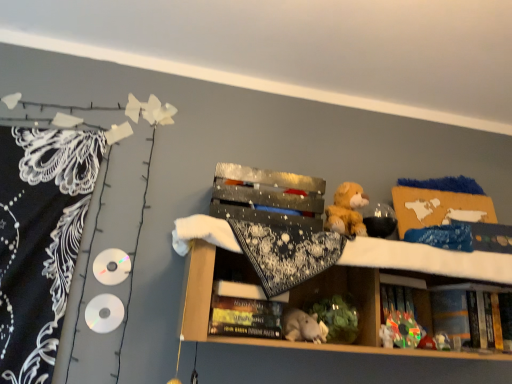
Image resolution: width=512 pixels, height=384 pixels. Describe the element at coordinates (40, 240) in the screenshot. I see `black lace blanket at left` at that location.

The image size is (512, 384). Find the location of `plush toy at center, which is the 2th toy from top to bottom`. plush toy at center, which is the 2th toy from top to bottom is located at coordinates (404, 329).

Describe the element at coordinates (404, 329) in the screenshot. This screenshot has width=512, height=384. I see `plush toy at center, acting as the 2th toy starting from the bottom` at that location.

You are a GUI agent. You are given a task and a screenshot of the screen. Output one action in this format:
    pyautogui.click(x=<x>, y=<y>)
    Task: Click on the black lace blanket at left
    
    Given the screenshot: What is the action you would take?
    pyautogui.click(x=40, y=240)

Between hardcover book at center, the 2th book viewed from the back, and black lace blanket at left, which one has smaller size?

hardcover book at center, the 2th book viewed from the back.

How distant is hardcover book at center, the 2th book viewed from the back, from black lace blanket at left?

hardcover book at center, the 2th book viewed from the back, is 64.89 centimeters from black lace blanket at left.

Considering the relative positions of hardcover book at center, the 2th book from the right, and black lace blanket at left in the image provided, is hardcover book at center, the 2th book from the right, to the right of black lace blanket at left from the viewer's perspective?

Yes, hardcover book at center, the 2th book from the right, is to the right of black lace blanket at left.

From a real-world perspective, between hardcover book at center, the first book from the left, and black lace blanket at left, who is vertically higher?

black lace blanket at left.

Where is `book above the plush toy at center, which is the 2th toy from top to bottom (from the image's perspective)`? This screenshot has width=512, height=384. book above the plush toy at center, which is the 2th toy from top to bottom (from the image's perspective) is located at coordinates pos(245,317).

Is plush toy at center, acting as the 2th toy starting from the bottom, not inside hardcover book at center, the 2th book from the right?

Yes, plush toy at center, acting as the 2th toy starting from the bottom, is not within hardcover book at center, the 2th book from the right.

Could you tell me if plush toy at center, which is the first toy from right to left, is facing hardcover book at center, the 2th book viewed from the back?

No.

Considering the sizes of objects plush toy at center, acting as the 2th toy starting from the bottom, and hardcover book at center, acting as the first book starting from the front, in the image provided, who is smaller, plush toy at center, acting as the 2th toy starting from the bottom, or hardcover book at center, acting as the first book starting from the front,?

plush toy at center, acting as the 2th toy starting from the bottom, is smaller.

Can you tell me how much shiny metallic box at center and fuzzy yellow teddy bear at upper right, which ranks as the first toy in left-to-right order, differ in facing direction?

The facing directions of shiny metallic box at center and fuzzy yellow teddy bear at upper right, which ranks as the first toy in left-to-right order, are 1.12 degrees apart.

Is shiny metallic box at center completely or partially outside of fuzzy yellow teddy bear at upper right, acting as the third toy starting from the bottom?

Yes, shiny metallic box at center is located beyond the bounds of fuzzy yellow teddy bear at upper right, acting as the third toy starting from the bottom.

Is point (202, 255) positioned in front of point (339, 216)?

Yes.

Is shiny metallic box at center behind fuzzy yellow teddy bear at upper right, acting as the third toy starting from the bottom?

That is False.

How distant is fuzzy yellow teddy bear at upper right, the first toy viewed from the top, from shiny metallic box at center?

fuzzy yellow teddy bear at upper right, the first toy viewed from the top, and shiny metallic box at center are 12.62 inches apart.

Considering the sizes of objects fuzzy yellow teddy bear at upper right, the first toy viewed from the top, and shiny metallic box at center in the image provided, who is shorter, fuzzy yellow teddy bear at upper right, the first toy viewed from the top, or shiny metallic box at center?

With less height is fuzzy yellow teddy bear at upper right, the first toy viewed from the top.

Can you confirm if fuzzy yellow teddy bear at upper right, acting as the third toy starting from the bottom, is positioned to the right of shiny metallic box at center?

Incorrect, fuzzy yellow teddy bear at upper right, acting as the third toy starting from the bottom, is not on the right side of shiny metallic box at center.

Consider the image. Is gray plush toy at center thinner than hardcover book at lower right, which ranks as the 1th book in right-to-left order?

Incorrect, the width of gray plush toy at center is not less than that of hardcover book at lower right, which ranks as the 1th book in right-to-left order.

Is point (289, 328) closer to viewer compared to point (478, 292)?

Yes, point (289, 328) is in front of point (478, 292).

Considering the relative positions of black lace blanket at left and hardcover book at lower right, which is the first book in back-to-front order, in the image provided, is black lace blanket at left to the left of hardcover book at lower right, which is the first book in back-to-front order, from the viewer's perspective?

Yes.

Based on the photo, which of these two, black lace blanket at left or hardcover book at lower right, which is the first book in back-to-front order, is thinner?

Thinner between the two is black lace blanket at left.

Is black lace blanket at left shorter than hardcover book at lower right, which ranks as the 1th book in right-to-left order?

Incorrect, the height of black lace blanket at left does not fall short of that of hardcover book at lower right, which ranks as the 1th book in right-to-left order.

From a real-world perspective, is black lace blanket at left below hardcover book at lower right, acting as the 2th book starting from the left?

Incorrect, from a real-world perspective, black lace blanket at left is higher than hardcover book at lower right, acting as the 2th book starting from the left.

Considering the relative positions of hardcover book at center, the 2th book viewed from the back, and fuzzy yellow teddy bear at upper right, the first toy viewed from the top, in the image provided, is hardcover book at center, the 2th book viewed from the back, behind fuzzy yellow teddy bear at upper right, the first toy viewed from the top,?

No, the depth of hardcover book at center, the 2th book viewed from the back, is less than that of fuzzy yellow teddy bear at upper right, the first toy viewed from the top.

At what (x,y) coordinates should I click in order to perform the action: click on toy above the hardcover book at center, the 2th book from the right (from the image's perspective). Please return your answer as a coordinate pair (x, y). This screenshot has height=384, width=512. Looking at the image, I should click on 347,210.

Is hardcover book at center, the first book from the left, facing away from fuzzy yellow teddy bear at upper right, acting as the 3th toy starting from the right?

No, hardcover book at center, the first book from the left,'s orientation is not away from fuzzy yellow teddy bear at upper right, acting as the 3th toy starting from the right.

At what (x,y) coordinates should I click in order to perform the action: click on book that is the 2nd object directly below the black lace blanket at left (from a real-world perspective). Please return your answer as a coordinate pair (x, y). Image resolution: width=512 pixels, height=384 pixels. Looking at the image, I should click on (245, 317).

The width and height of the screenshot is (512, 384). I want to click on the 1st book positioned above the plush toy at center, acting as the 2th toy starting from the bottom (from a real-world perspective), so click(245, 317).

When comparing their distances from plush toy at center, which is the 2th toy from top to bottom, does gray plush toy at center or black lace blanket at left seem closer?

The object closer to plush toy at center, which is the 2th toy from top to bottom, is gray plush toy at center.

Based on their spatial positions, is shiny metallic box at center or gray plush toy at center further from hardcover book at center, the first book from the left?

The object further to hardcover book at center, the first book from the left, is shiny metallic box at center.

Based on their spatial positions, is shiny metallic box at center or plush toy at center, which is the 2th toy from top to bottom, closer to gray plush toy at center?

The object closer to gray plush toy at center is shiny metallic box at center.

Considering their positions, is hardcover book at lower right, acting as the second book starting from the front, positioned closer to plush toy at center, which is counted as the 3th toy, starting from the left, than gray plush toy at center?

Among the two, hardcover book at lower right, acting as the second book starting from the front, is located nearer to plush toy at center, which is counted as the 3th toy, starting from the left.

Looking at the image, which one is located further to plush toy at center, acting as the 2th toy starting from the bottom, fuzzy yellow teddy bear at upper right, acting as the third toy starting from the bottom, or shiny metallic box at center?

Based on the image, fuzzy yellow teddy bear at upper right, acting as the third toy starting from the bottom, appears to be further to plush toy at center, acting as the 2th toy starting from the bottom.

From the image, which object appears to be farther from hardcover book at center, the first book from the left, black lace blanket at left or hardcover book at lower right, which ranks as the 1th book in right-to-left order?

hardcover book at lower right, which ranks as the 1th book in right-to-left order, is further to hardcover book at center, the first book from the left.

Based on their spatial positions, is hardcover book at lower right, which ranks as the 1th book in right-to-left order, or hardcover book at center, the 2th book viewed from the back, further from white plush toy at center, acting as the 2th toy starting from the right?

hardcover book at center, the 2th book viewed from the back, is positioned further to the anchor white plush toy at center, acting as the 2th toy starting from the right.

Based on their spatial positions, is black lace blanket at left or plush toy at center, acting as the 2th toy starting from the bottom, further from fuzzy yellow teddy bear at upper right, which ranks as the first toy in left-to-right order?

black lace blanket at left is positioned further to the anchor fuzzy yellow teddy bear at upper right, which ranks as the first toy in left-to-right order.

I want to click on animal between fuzzy yellow teddy bear at upper right, which ranks as the first toy in left-to-right order, and white plush toy at center, placed as the second toy when sorted from left to right, in the vertical direction, so click(x=303, y=326).

At what (x,y) coordinates should I click in order to perform the action: click on shelf between fuzzy yellow teddy bear at upper right, acting as the third toy starting from the bottom, and plush toy at center, acting as the 2th toy starting from the bottom, in the vertical direction. Please return your answer as a coordinate pair (x, y). Looking at the image, I should click on (290, 302).

Locate an element on the screen. Image resolution: width=512 pixels, height=384 pixels. animal situated between hardcover book at center, the first book from the left, and white plush toy at center, which ranks as the first toy in bottom-to-top order, from left to right is located at coordinates (303, 326).

This screenshot has width=512, height=384. I want to click on shelf situated between hardcover book at center, the first book from the left, and plush toy at center, which is the first toy from right to left, from left to right, so click(x=290, y=302).